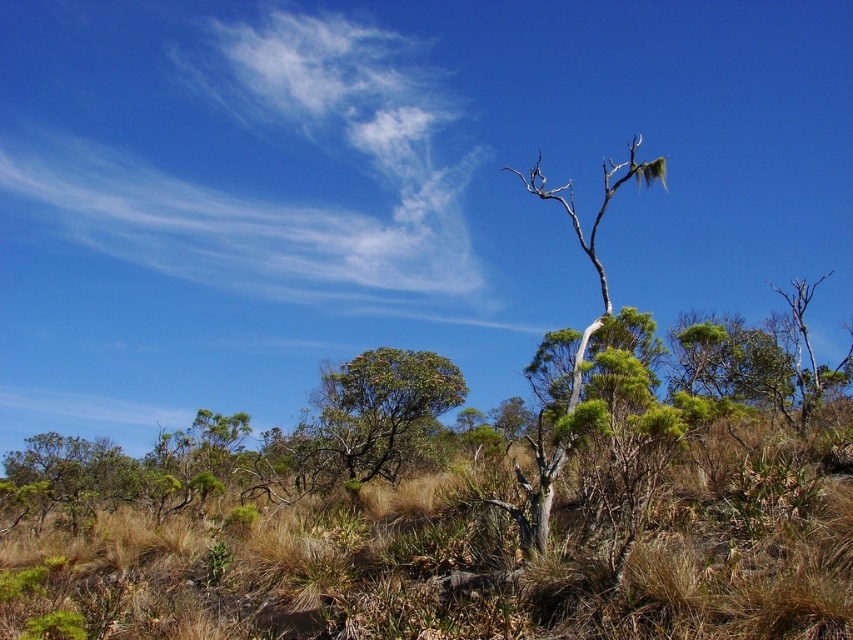
In the natural landscape scene, you need to determine which object is smaller between the green leafy shrub at center and the gray bark tree at center. Which one is smaller?

The green leafy shrub at center has a smaller size compared to the gray bark tree at center, so the green leafy shrub at center is smaller.